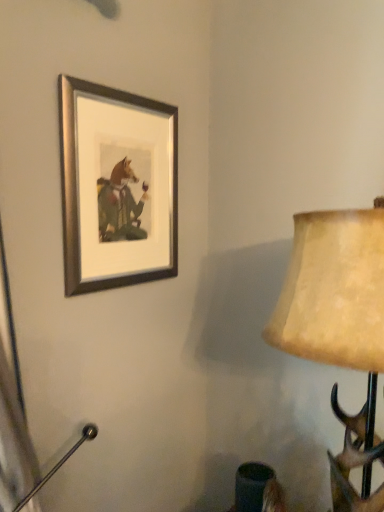
The image size is (384, 512). What are the coordinates of `matte beige lampshade at right` in the screenshot? It's located at (339, 327).

Measure the distance between point (370, 340) and camera.

Point (370, 340) and camera are 23.66 inches apart.

What do you see at coordinates (339, 327) in the screenshot?
I see `matte beige lampshade at right` at bounding box center [339, 327].

What do you see at coordinates (117, 187) in the screenshot? This screenshot has height=512, width=384. I see `silver/metallic picture frame at upper left` at bounding box center [117, 187].

Where is `silver/metallic picture frame at upper left`? silver/metallic picture frame at upper left is located at coordinates (117, 187).

At what (x,y) coordinates should I click in order to perform the action: click on matte beige lampshade at right. Please return your answer as a coordinate pair (x, y). This screenshot has height=512, width=384. Looking at the image, I should click on (339, 327).

Looking at this image, which object is positioned more to the left, silver/metallic picture frame at upper left or matte beige lampshade at right?

Positioned to the left is silver/metallic picture frame at upper left.

Is the position of silver/metallic picture frame at upper left less distant than that of matte beige lampshade at right?

No, silver/metallic picture frame at upper left is behind matte beige lampshade at right.

Which point is more distant from viewer, (132, 213) or (337, 304)?

The point (132, 213) is behind.

Based on the photo, from the image's perspective, between silver/metallic picture frame at upper left and matte beige lampshade at right, which one is located above?

silver/metallic picture frame at upper left is shown above in the image.

From a real-world perspective, is silver/metallic picture frame at upper left positioned above or below matte beige lampshade at right?

From a real-world perspective, silver/metallic picture frame at upper left is physically above matte beige lampshade at right.

Which of these two, silver/metallic picture frame at upper left or matte beige lampshade at right, is wider?

matte beige lampshade at right is wider.

Does silver/metallic picture frame at upper left have a lesser height compared to matte beige lampshade at right?

Yes, silver/metallic picture frame at upper left is shorter than matte beige lampshade at right.

Does silver/metallic picture frame at upper left have a smaller size compared to matte beige lampshade at right?

Yes.

Is matte beige lampshade at right a part of silver/metallic picture frame at upper left?

Definitely not — matte beige lampshade at right is not inside silver/metallic picture frame at upper left.

Can you see silver/metallic picture frame at upper left touching matte beige lampshade at right?

They are not placed beside each other.

Is silver/metallic picture frame at upper left positioned with its back to matte beige lampshade at right?

No, matte beige lampshade at right is not at the back of silver/metallic picture frame at upper left.

How different are the orientations of silver/metallic picture frame at upper left and matte beige lampshade at right in degrees?

The facing directions of silver/metallic picture frame at upper left and matte beige lampshade at right are 90 degrees apart.

The height and width of the screenshot is (512, 384). There is a matte beige lampshade at right. Find the location of `picture frame above it (from a real-world perspective)`. picture frame above it (from a real-world perspective) is located at coordinates (117, 187).

Considering the relative positions of matte beige lampshade at right and silver/metallic picture frame at upper left in the image provided, is matte beige lampshade at right to the left of silver/metallic picture frame at upper left from the viewer's perspective?

No.

From the picture: Which object is more forward, matte beige lampshade at right or silver/metallic picture frame at upper left?

matte beige lampshade at right.

Which is closer, (323, 301) or (84, 138)?

The point (323, 301) is closer to the camera.

From the image's perspective, is matte beige lampshade at right located above silver/metallic picture frame at upper left?

No, from the image's perspective, matte beige lampshade at right is not over silver/metallic picture frame at upper left.

Based on the photo, from a real-world perspective, is matte beige lampshade at right positioned above or below silver/metallic picture frame at upper left?

From a real-world perspective, matte beige lampshade at right is physically below silver/metallic picture frame at upper left.

In terms of width, does matte beige lampshade at right look wider or thinner when compared to silver/metallic picture frame at upper left?

Clearly, matte beige lampshade at right has more width compared to silver/metallic picture frame at upper left.

Considering the sizes of matte beige lampshade at right and silver/metallic picture frame at upper left in the image, is matte beige lampshade at right taller or shorter than silver/metallic picture frame at upper left?

matte beige lampshade at right is taller than silver/metallic picture frame at upper left.

Considering the sizes of objects matte beige lampshade at right and silver/metallic picture frame at upper left in the image provided, who is smaller, matte beige lampshade at right or silver/metallic picture frame at upper left?

With smaller size is silver/metallic picture frame at upper left.

Can we say matte beige lampshade at right lies outside silver/metallic picture frame at upper left?

Absolutely, matte beige lampshade at right is external to silver/metallic picture frame at upper left.

Are matte beige lampshade at right and silver/metallic picture frame at upper left making contact?

No, matte beige lampshade at right is not making contact with silver/metallic picture frame at upper left.

Does matte beige lampshade at right turn towards silver/metallic picture frame at upper left?

No, matte beige lampshade at right is not oriented towards silver/metallic picture frame at upper left.

Looking at this image, how many degrees apart are the facing directions of matte beige lampshade at right and silver/metallic picture frame at upper left?

90 degrees.

What are the coordinates of `picture frame behind the matte beige lampshade at right` in the screenshot? It's located at (117, 187).

Identify the location of lamp on the right of silver/metallic picture frame at upper left. (339, 327).

At what (x,y) coordinates should I click in order to perform the action: click on picture frame on the left side of matte beige lampshade at right. Please return your answer as a coordinate pair (x, y). Looking at the image, I should click on (117, 187).